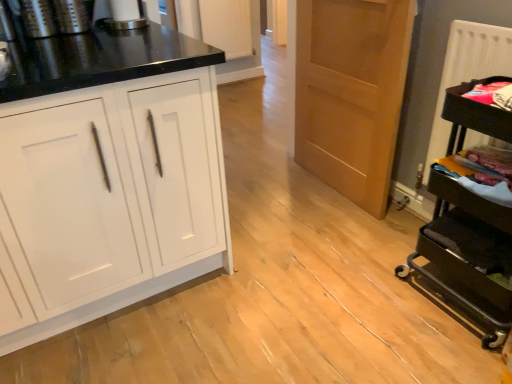
Measure the distance between point (24, 5) and camera.

The depth of point (24, 5) is 5.12 feet.

This screenshot has width=512, height=384. Identify the location of white glossy cabinet at left. pyautogui.click(x=109, y=198).

Measure the distance between point (141, 21) and camera.

The depth of point (141, 21) is 1.79 meters.

What is the approximate width of brushed metal coffee maker at upper left, placed as the third appliance when sorted from bottom to top?

The width of brushed metal coffee maker at upper left, placed as the third appliance when sorted from bottom to top, is 4.71 inches.

Identify the location of brushed metal coffee grinder at upper left, the second appliance when ordered from bottom to top. This screenshot has height=384, width=512. coord(38,18).

Would you say light brown wood door at center is inside or outside white glossy paper towel dispenser at upper center, which appears as the first appliance when viewed from the top?

light brown wood door at center is not inside white glossy paper towel dispenser at upper center, which appears as the first appliance when viewed from the top, it's outside.

Measure the distance from light brown wood door at center to white glossy paper towel dispenser at upper center, the 3th appliance in the left-to-right sequence.

A distance of 1.03 meters exists between light brown wood door at center and white glossy paper towel dispenser at upper center, the 3th appliance in the left-to-right sequence.

From a real-world perspective, which object stands above the other?

white glossy paper towel dispenser at upper center, the 3th appliance in the left-to-right sequence.

Between light brown wood door at center and white glossy paper towel dispenser at upper center, the 4th appliance when ordered from bottom to top, which one has smaller width?

Thinner between the two is light brown wood door at center.

Between white glossy cabinet at left and white glossy paper towel dispenser at upper center, the 3th appliance in the left-to-right sequence, which one has larger width?

white glossy cabinet at left is wider.

Based on the photo, from a real-world perspective, is white glossy cabinet at left on top of white glossy paper towel dispenser at upper center, which is the 2th appliance in right-to-left order?

No, from a real-world perspective, white glossy cabinet at left is not on top of white glossy paper towel dispenser at upper center, which is the 2th appliance in right-to-left order.

Is white glossy cabinet at left situated inside white glossy paper towel dispenser at upper center, the 3th appliance in the left-to-right sequence, or outside?

white glossy cabinet at left is not inside white glossy paper towel dispenser at upper center, the 3th appliance in the left-to-right sequence, it's outside.

Between white glossy cabinet at left and white glossy paper towel dispenser at upper center, the 3th appliance in the left-to-right sequence, which one appears on the right side from the viewer's perspective?

Positioned to the right is white glossy paper towel dispenser at upper center, the 3th appliance in the left-to-right sequence.

Which of these two, white textured radiator at right or brushed metal coffee maker at upper left, the second appliance from the left, is smaller?

brushed metal coffee maker at upper left, the second appliance from the left.

Which appliance is the 3rd one when counting from the back of the white textured radiator at right? Please provide its 2D coordinates.

[(73, 15)]

Can you confirm if white textured radiator at right is thinner than brushed metal coffee maker at upper left, which is counted as the second appliance, starting from the top?

In fact, white textured radiator at right might be wider than brushed metal coffee maker at upper left, which is counted as the second appliance, starting from the top.

In the scene shown: Is white textured radiator at right positioned behind brushed metal coffee maker at upper left, which is counted as the second appliance, starting from the top?

No, it is in front of brushed metal coffee maker at upper left, which is counted as the second appliance, starting from the top.

Is white glossy paper towel dispenser at upper center, which is the 2th appliance in right-to-left order, spatially inside brushed metal coffee grinder at upper left, which is counted as the third appliance, starting from the top, or outside of it?

white glossy paper towel dispenser at upper center, which is the 2th appliance in right-to-left order, is not enclosed by brushed metal coffee grinder at upper left, which is counted as the third appliance, starting from the top.

From a real-world perspective, who is located higher, white glossy paper towel dispenser at upper center, which appears as the first appliance when viewed from the top, or brushed metal coffee grinder at upper left, acting as the 4th appliance starting from the right?

From a 3D spatial view, white glossy paper towel dispenser at upper center, which appears as the first appliance when viewed from the top, is above.

Considering the relative sizes of white glossy paper towel dispenser at upper center, which is the 2th appliance in right-to-left order, and brushed metal coffee grinder at upper left, the second appliance when ordered from bottom to top, in the image provided, is white glossy paper towel dispenser at upper center, which is the 2th appliance in right-to-left order, thinner than brushed metal coffee grinder at upper left, the second appliance when ordered from bottom to top,?

No.

How distant is white glossy paper towel dispenser at upper center, which is the 2th appliance in right-to-left order, from brushed metal coffee grinder at upper left, the second appliance when ordered from bottom to top?

white glossy paper towel dispenser at upper center, which is the 2th appliance in right-to-left order, and brushed metal coffee grinder at upper left, the second appliance when ordered from bottom to top, are 10.15 inches apart from each other.

From the image's perspective, is white glossy paper towel dispenser at upper center, the 3th appliance in the left-to-right sequence, on top of light brown wood door at center?

Indeed, from the image's perspective, white glossy paper towel dispenser at upper center, the 3th appliance in the left-to-right sequence, is shown above light brown wood door at center.

Is white glossy paper towel dispenser at upper center, the 3th appliance in the left-to-right sequence, turned away from light brown wood door at center?

No, white glossy paper towel dispenser at upper center, the 3th appliance in the left-to-right sequence,'s orientation is not away from light brown wood door at center.

From a real-world perspective, which is physically above, white glossy paper towel dispenser at upper center, the 3th appliance in the left-to-right sequence, or light brown wood door at center?

white glossy paper towel dispenser at upper center, the 3th appliance in the left-to-right sequence, from a real-world perspective.

Which is in front, point (139, 21) or point (392, 157)?

The point (139, 21) is more forward.

Between white glossy paper towel dispenser at upper center, which is the 2th appliance in right-to-left order, and black metal cart at right, the 4th appliance from the top, which one has larger size?

Result: black metal cart at right, the 4th appliance from the top, is bigger.

From a real-world perspective, is white glossy paper towel dispenser at upper center, the 3th appliance in the left-to-right sequence, on black metal cart at right, the first appliance from the right?

Yes, from a real-world perspective, white glossy paper towel dispenser at upper center, the 3th appliance in the left-to-right sequence, is over black metal cart at right, the first appliance from the right

Are white glossy paper towel dispenser at upper center, the 4th appliance when ordered from bottom to top, and black metal cart at right, the 4th appliance from the top, located far from each other?

white glossy paper towel dispenser at upper center, the 4th appliance when ordered from bottom to top, is positioned a significant distance from black metal cart at right, the 4th appliance from the top.

Considering the relative positions of white glossy paper towel dispenser at upper center, which is the 2th appliance in right-to-left order, and black metal cart at right, the first appliance from the right, in the image provided, is white glossy paper towel dispenser at upper center, which is the 2th appliance in right-to-left order, to the left of black metal cart at right, the first appliance from the right, from the viewer's perspective?

Yes, white glossy paper towel dispenser at upper center, which is the 2th appliance in right-to-left order, is to the left of black metal cart at right, the first appliance from the right.

From the image's perspective, who appears lower, white glossy paper towel dispenser at upper center, the 4th appliance when ordered from bottom to top, or white glossy cabinet at left?

white glossy cabinet at left.

Is white glossy cabinet at left located within white glossy paper towel dispenser at upper center, which appears as the first appliance when viewed from the top?

No, white glossy cabinet at left is located outside of white glossy paper towel dispenser at upper center, which appears as the first appliance when viewed from the top.

From their relative heights in the image, would you say white glossy paper towel dispenser at upper center, the 3th appliance in the left-to-right sequence, is taller or shorter than white glossy cabinet at left?

Clearly, white glossy paper towel dispenser at upper center, the 3th appliance in the left-to-right sequence, is shorter compared to white glossy cabinet at left.

Identify the location of door on the right of white glossy paper towel dispenser at upper center, the 4th appliance when ordered from bottom to top. (351, 93).

The width and height of the screenshot is (512, 384). In order to click on the 3rd appliance behind the white glossy cabinet at left in this screenshot , I will do `click(124, 15)`.

Considering their positions, is light brown wood door at center positioned closer to brushed metal coffee grinder at upper left, acting as the 4th appliance starting from the right, than white glossy cabinet at left?

white glossy cabinet at left lies closer to brushed metal coffee grinder at upper left, acting as the 4th appliance starting from the right, than the other object.

When comparing their distances from white glossy cabinet at left, does light brown wood door at center or white glossy paper towel dispenser at upper center, which is the 2th appliance in right-to-left order, seem further?

light brown wood door at center is positioned further to the anchor white glossy cabinet at left.

Looking at the image, which one is located closer to brushed metal coffee grinder at upper left, the second appliance when ordered from bottom to top, brushed metal coffee maker at upper left, which is counted as the second appliance, starting from the top, or white textured radiator at right?

The object closer to brushed metal coffee grinder at upper left, the second appliance when ordered from bottom to top, is brushed metal coffee maker at upper left, which is counted as the second appliance, starting from the top.

From the picture: Considering their positions, is white glossy cabinet at left positioned closer to light brown wood door at center than white glossy paper towel dispenser at upper center, which appears as the first appliance when viewed from the top?

Among the two, white glossy paper towel dispenser at upper center, which appears as the first appliance when viewed from the top, is located nearer to light brown wood door at center.

Estimate the real-world distances between objects in this image. Which object is further from white glossy paper towel dispenser at upper center, which is the 2th appliance in right-to-left order, light brown wood door at center or brushed metal coffee maker at upper left, which is counted as the second appliance, starting from the top?

light brown wood door at center is positioned further to the anchor white glossy paper towel dispenser at upper center, which is the 2th appliance in right-to-left order.

When comparing their distances from white glossy paper towel dispenser at upper center, the 3th appliance in the left-to-right sequence, does black metal cart at right, acting as the 4th appliance starting from the left, or white glossy cabinet at left seem closer?

white glossy cabinet at left is positioned closer to the anchor white glossy paper towel dispenser at upper center, the 3th appliance in the left-to-right sequence.

From the image, which object appears to be nearer to white textured radiator at right, black metal cart at right, the first appliance from the bottom, or brushed metal coffee grinder at upper left, which is counted as the third appliance, starting from the top?

black metal cart at right, the first appliance from the bottom, is positioned closer to the anchor white textured radiator at right.

When comparing their distances from light brown wood door at center, does white textured radiator at right or brushed metal coffee maker at upper left, which is counted as the second appliance, starting from the top, seem closer?

The object closer to light brown wood door at center is white textured radiator at right.

Where is `door situated between white glossy paper towel dispenser at upper center, the 4th appliance when ordered from bottom to top, and black metal cart at right, the first appliance from the right, from left to right`? This screenshot has height=384, width=512. door situated between white glossy paper towel dispenser at upper center, the 4th appliance when ordered from bottom to top, and black metal cart at right, the first appliance from the right, from left to right is located at coordinates (351, 93).

Locate an element on the screen. appliance situated between white glossy paper towel dispenser at upper center, which appears as the first appliance when viewed from the top, and white textured radiator at right from left to right is located at coordinates pos(468,254).

Locate an element on the screen. door situated between white glossy paper towel dispenser at upper center, the 3th appliance in the left-to-right sequence, and white textured radiator at right from left to right is located at coordinates (351, 93).

Identify the location of cabinetry located between brushed metal coffee maker at upper left, arranged as the third appliance when viewed from the right, and light brown wood door at center in the left-right direction. (109, 198).